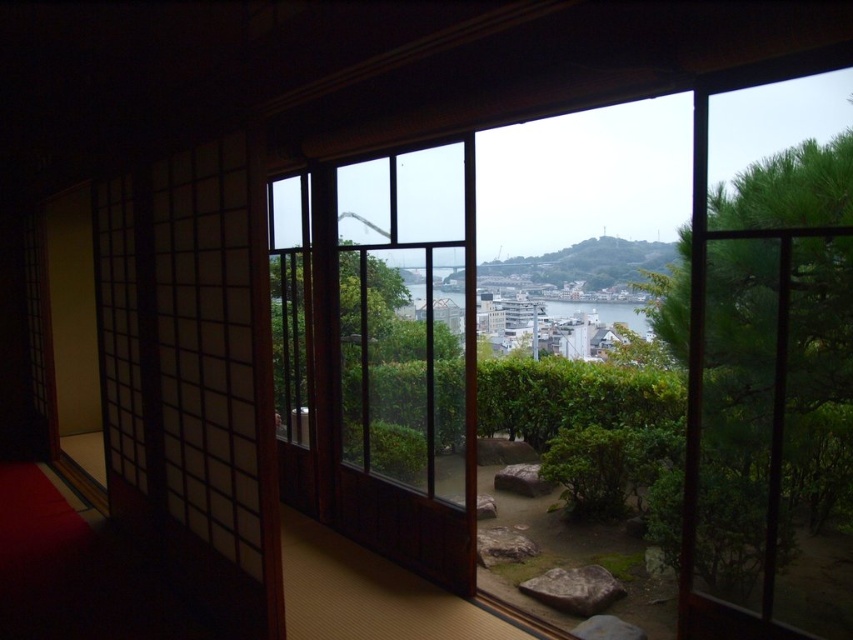
Question: Which object appears farthest from the camera in this image?

Choices:
 (A) brown rough stone at center
 (B) transparent glass window at center

Answer: (A)

Question: Does gray rough stone at lower center appear under brown rough stone at center?

Choices:
 (A) yes
 (B) no

Answer: (A)

Question: Can you confirm if transparent glass window at center is positioned to the right of brown rough stone at center?

Choices:
 (A) yes
 (B) no

Answer: (A)

Question: Which object appears farthest from the camera in this image?

Choices:
 (A) brown rough stone at center
 (B) gray rough stone at lower center
 (C) transparent glass window at center

Answer: (A)

Question: Which of these objects is positioned closest to the brown rough stone at center?

Choices:
 (A) transparent glass window at center
 (B) gray rough stone at lower center

Answer: (B)

Question: Is gray rough stone at lower center thinner than brown rough stone at center?

Choices:
 (A) yes
 (B) no

Answer: (B)